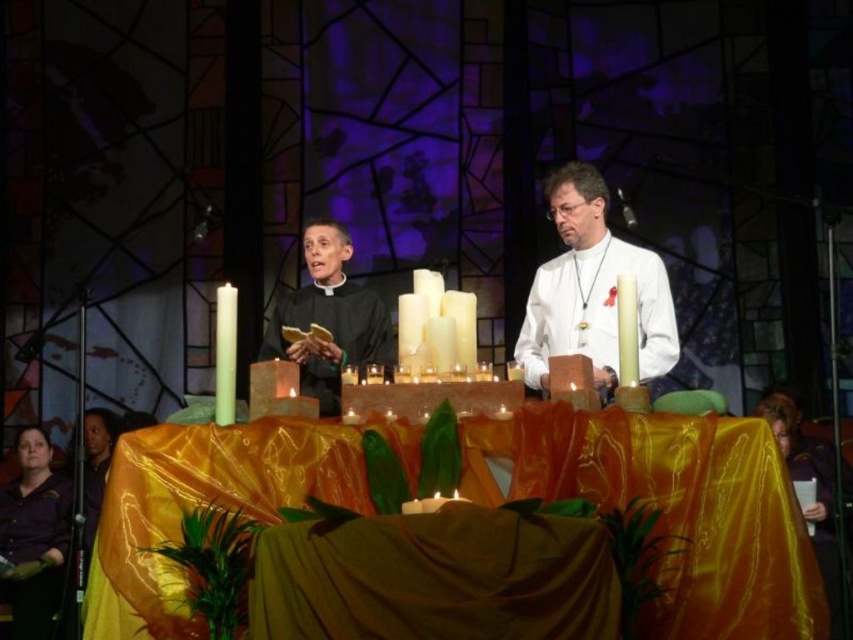
In the scene shown: Measure the distance between point (674, 596) and camera.

Point (674, 596) is 25.35 meters from camera.

Can you confirm if silky gold tablecloth at center is shorter than white matte shirt at center?

Correct, silky gold tablecloth at center is not as tall as white matte shirt at center.

Does point (581, 428) come farther from viewer compared to point (622, 273)?

No.

The image size is (853, 640). I want to click on silky gold tablecloth at center, so (x=672, y=508).

Can you confirm if silky gold tablecloth at center is wider than purple satin robe at lower left?

Correct, the width of silky gold tablecloth at center exceeds that of purple satin robe at lower left.

Who is more distant from viewer, (x=189, y=621) or (x=9, y=522)?

Positioned behind is point (x=9, y=522).

This screenshot has width=853, height=640. Identify the location of silky gold tablecloth at center. (672, 508).

Is white matte shirt at center shorter than matte black robe at center?

In fact, white matte shirt at center may be taller than matte black robe at center.

From the picture: Can you confirm if white matte shirt at center is positioned to the right of matte black robe at center?

Correct, you'll find white matte shirt at center to the right of matte black robe at center.

I want to click on white matte shirt at center, so click(x=592, y=289).